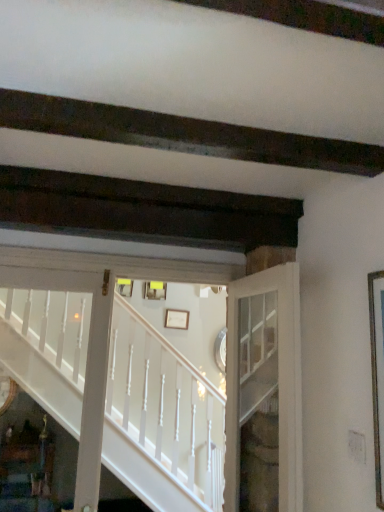
Question: From a real-world perspective, is white glass door at center on matte yellow picture frame at center, which is counted as the first picture frame, starting from the top?

Choices:
 (A) yes
 (B) no

Answer: (B)

Question: Does white glass door at center lie in front of matte yellow picture frame at center, placed as the 1th picture frame when sorted from left to right?

Choices:
 (A) no
 (B) yes

Answer: (B)

Question: From the image's perspective, does white glass door at center appear higher than matte yellow picture frame at center, acting as the 2th picture frame starting from the bottom?

Choices:
 (A) no
 (B) yes

Answer: (A)

Question: Does white glass door at center appear on the left side of matte yellow picture frame at center, acting as the 2th picture frame starting from the bottom?

Choices:
 (A) yes
 (B) no

Answer: (B)

Question: Is white glass door at center positioned far away from matte yellow picture frame at center, which is counted as the first picture frame, starting from the top?

Choices:
 (A) yes
 (B) no

Answer: (A)

Question: Is white painted wood stairs at center wider or thinner than matte yellow picture frame at center, which is counted as the first picture frame, starting from the top?

Choices:
 (A) thin
 (B) wide

Answer: (B)

Question: Considering their positions, is white painted wood stairs at center located in front of or behind matte yellow picture frame at center, which is counted as the first picture frame, starting from the top?

Choices:
 (A) behind
 (B) front

Answer: (B)

Question: Is point (102, 441) closer or farther from the camera than point (150, 290)?

Choices:
 (A) closer
 (B) farther

Answer: (A)

Question: Considering the positions of white painted wood stairs at center and matte yellow picture frame at center, which is counted as the first picture frame, starting from the top, in the image, is white painted wood stairs at center bigger or smaller than matte yellow picture frame at center, which is counted as the first picture frame, starting from the top,?

Choices:
 (A) small
 (B) big

Answer: (B)

Question: In terms of width, does white glass door at center look wider or thinner when compared to matte yellow picture frame at center, acting as the 2th picture frame starting from the bottom?

Choices:
 (A) thin
 (B) wide

Answer: (B)

Question: Would you say white glass door at center is to the left or to the right of matte yellow picture frame at center, which appears as the 2th picture frame when viewed from the right, in the picture?

Choices:
 (A) right
 (B) left

Answer: (A)

Question: Based on their sizes in the image, would you say white glass door at center is bigger or smaller than matte yellow picture frame at center, which appears as the 2th picture frame when viewed from the right?

Choices:
 (A) big
 (B) small

Answer: (A)

Question: Is point (266, 390) closer or farther from the camera than point (153, 286)?

Choices:
 (A) farther
 (B) closer

Answer: (B)

Question: Does point (155, 501) appear closer or farther from the camera than point (185, 320)?

Choices:
 (A) closer
 (B) farther

Answer: (A)

Question: From the image's perspective, is white painted wood stairs at center located above or below white matte picture frame at center, marked as the first picture frame in a right-to-left arrangement?

Choices:
 (A) above
 (B) below

Answer: (A)